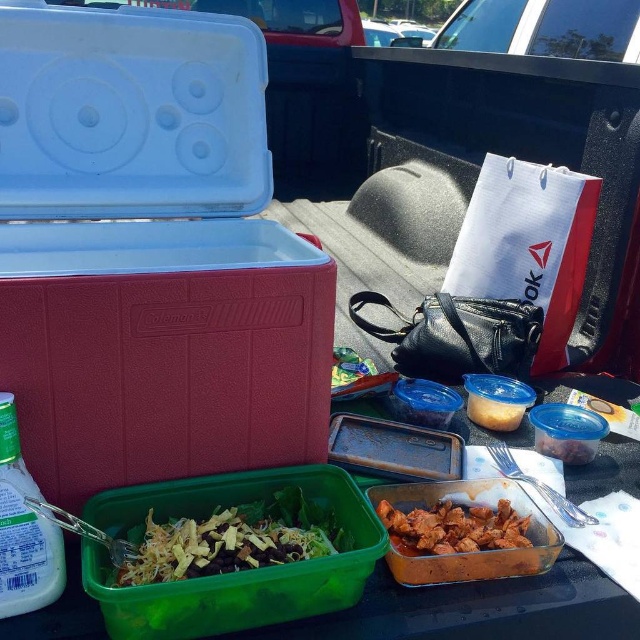
Is point (632, 392) in front of point (262, 548)?

No, (632, 392) is behind (262, 548).

Which is behind, point (547, 628) or point (122, 566)?

Positioned behind is point (547, 628).

Identify the location of green plastic container at lower center. (477, 609).

Is translucent plastic lunch box at lower left taller than green plastic container at lower center?

Yes, translucent plastic lunch box at lower left is taller than green plastic container at lower center.

Who is more distant from viewer, (88,355) or (518,579)?

The point (518,579) is more distant.

In order to click on translucent plastic lunch box at lower left in this screenshot , I will do `click(148, 253)`.

Does translucent plastic lunch box at lower left have a smaller size compared to green plastic salad bowl at center?

No.

Who is shorter, translucent plastic lunch box at lower left or green plastic salad bowl at center?

green plastic salad bowl at center

Is point (252, 120) more distant than point (269, 532)?

Yes, it is behind point (269, 532).

Image resolution: width=640 pixels, height=640 pixels. What are the coordinates of `translucent plastic lunch box at lower left` in the screenshot? It's located at (148, 253).